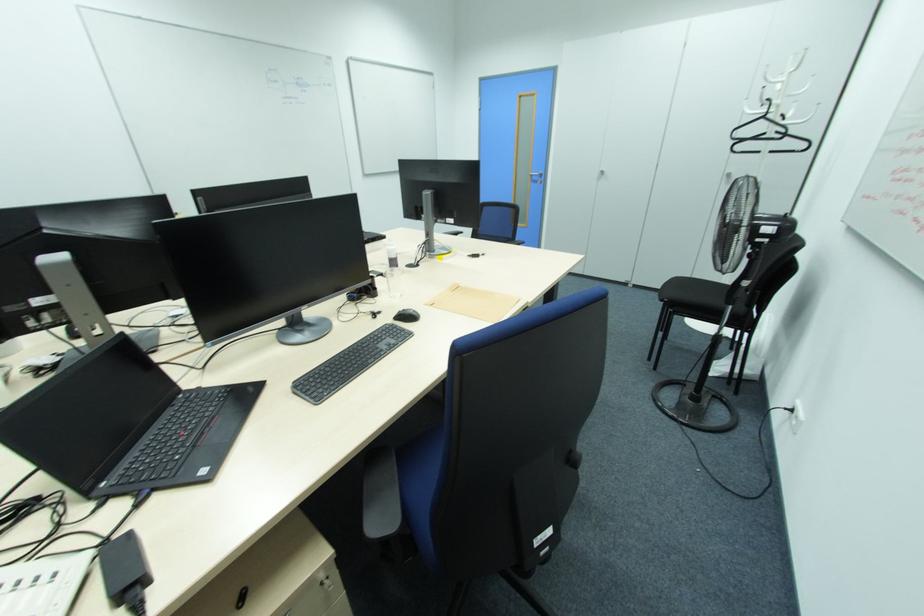
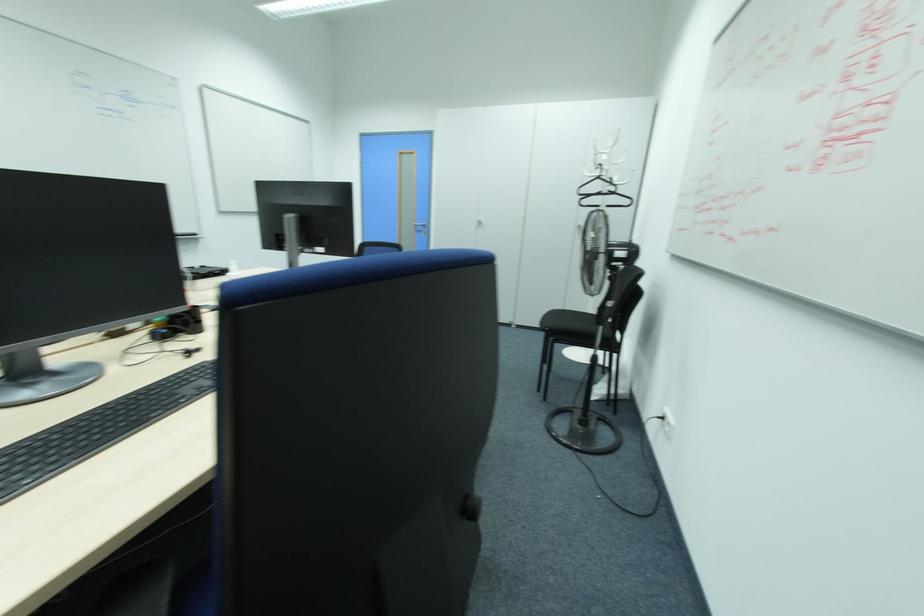
The point at (798,418) is marked in the first image. Where is the corresponding point in the second image?

(670, 424)